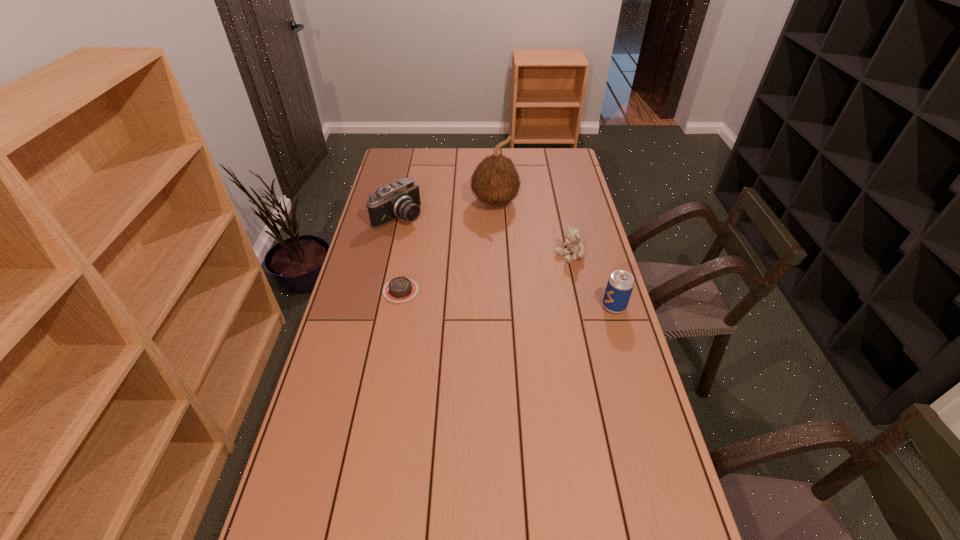
Locate an element on the screen. The height and width of the screenshot is (540, 960). chocolate cake is located at coordinates (400, 289).

The image size is (960, 540). In order to click on the rightmost object in this screenshot , I will do `click(620, 284)`.

Where is `teddy bear`? This screenshot has height=540, width=960. teddy bear is located at coordinates (576, 247).

This screenshot has height=540, width=960. Find the location of `the fourth object from left to right`. the fourth object from left to right is located at coordinates coord(576,247).

Image resolution: width=960 pixels, height=540 pixels. Identify the location of camera. (401, 199).

You are a GUI agent. You are given a task and a screenshot of the screen. Output one action in this format:
    pyautogui.click(x=<x>, y=<y>)
    Task: Click on the coconut
    This screenshot has width=960, height=540.
    Given the screenshot: What is the action you would take?
    pyautogui.click(x=495, y=181)

Locate an element on the screen. the third object from right to left is located at coordinates (495, 181).

In order to click on free space located 0.080m on the right of the shortest object in this screenshot , I will do `click(442, 291)`.

This screenshot has height=540, width=960. Find the location of `free space located on the left of the beer can`. free space located on the left of the beer can is located at coordinates (566, 306).

You are a GUI agent. You are given a task and a screenshot of the screen. Output one action in this format:
    pyautogui.click(x=<x>, y=<y>)
    Task: Click on the free region located on the face of the third farthest object
    Image resolution: width=960 pixels, height=540 pixels.
    Given the screenshot: What is the action you would take?
    pyautogui.click(x=522, y=275)